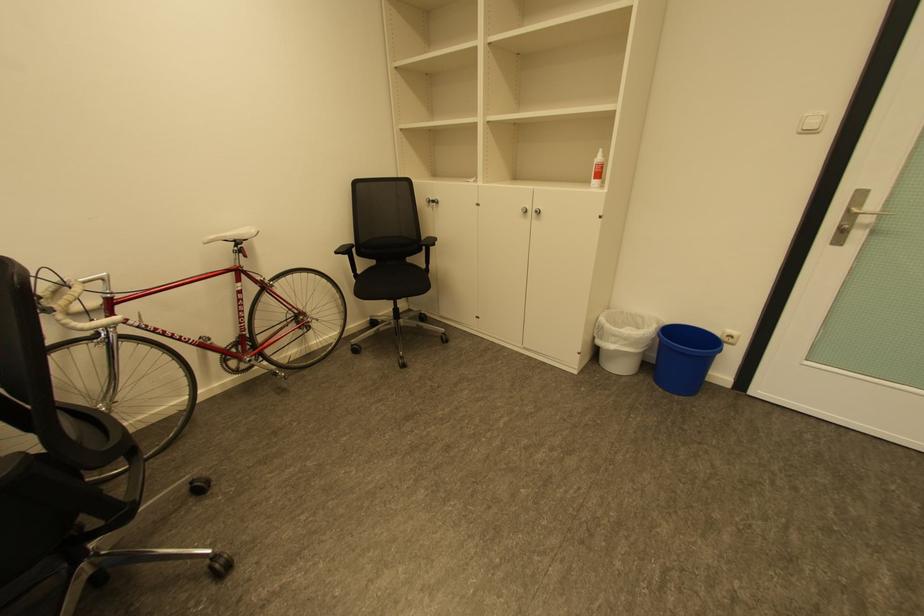
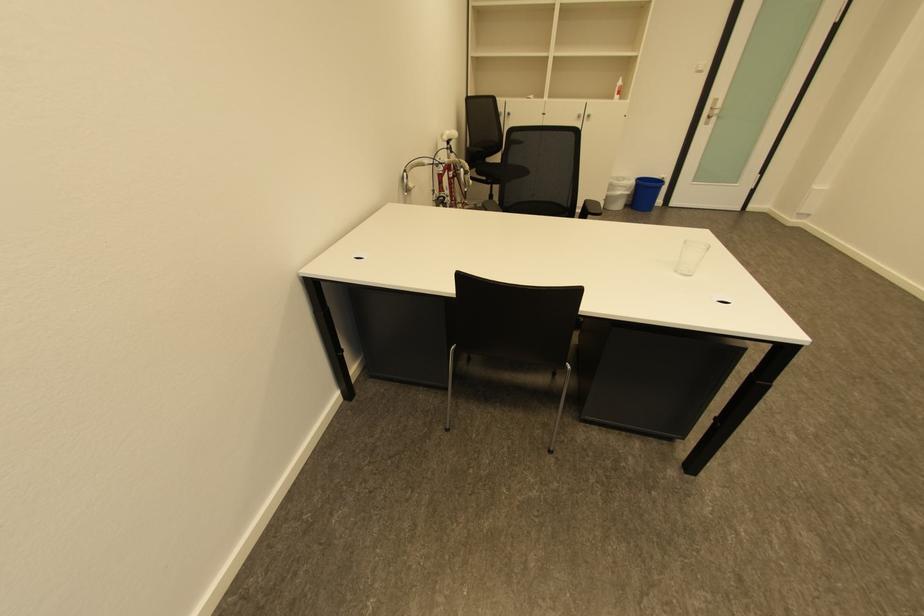
Where in the second image is the point corresponding to point (849, 232) from the first image?

(715, 119)